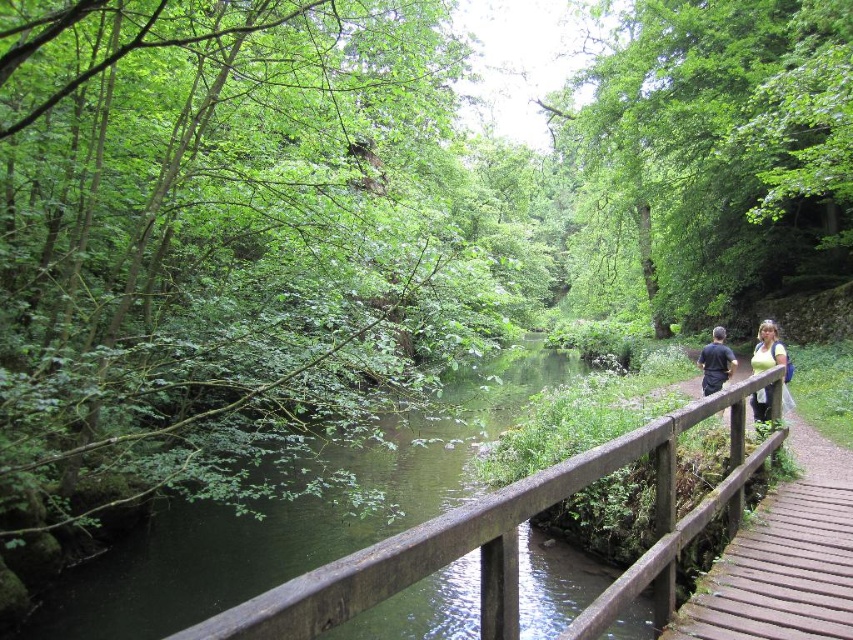
You are standing on the brown wooden bridge at center and want to look towards the green fabric top at upper right. Which direction should you turn your head?

You should turn your head to the right because the green fabric top at upper right is located to the right side of the brown wooden bridge at center.

You are standing on the brown wooden bridge at center and want to wave to the green fabric shirt at right who is on the other side of the bridge. Which direction should you move to get closer to them?

The brown wooden bridge at center is in front of green fabric shirt at right, so you should move towards the direction where the green fabric shirt at right is located to get closer to them.

You are a photographer standing on the wooden bridge and see the green fabric shirt at right and the green fabric top at upper right. Which person is closer to the left side of the bridge?

The green fabric shirt at right is positioned on the left side of the green fabric top at upper right, so the green fabric shirt at right is closer to the left side of the bridge.